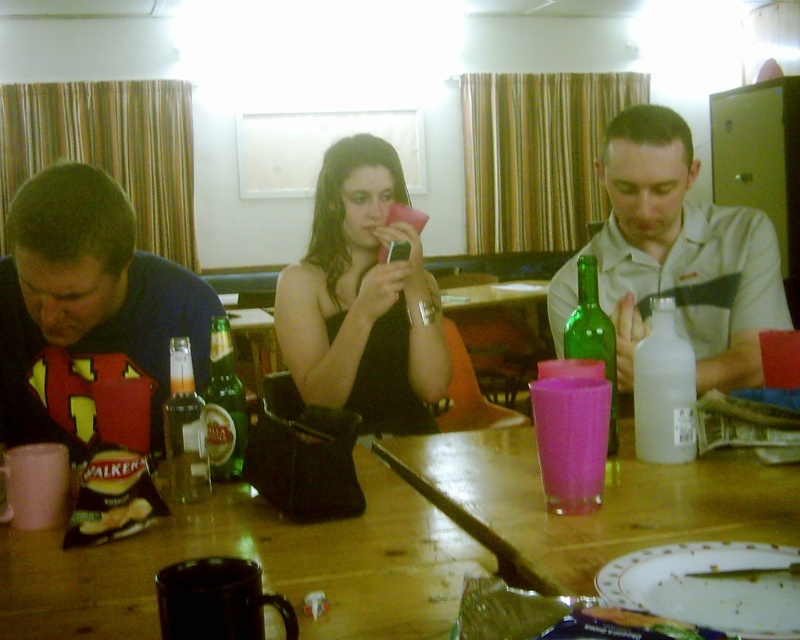
Question: Can you confirm if wooden table at center is positioned to the left of matte black shirt at left?

Choices:
 (A) no
 (B) yes

Answer: (A)

Question: Is green glass beer bottle at center wider than golden crispy chips at lower left?

Choices:
 (A) no
 (B) yes

Answer: (B)

Question: Which of these objects is positioned closest to the golden crispy chips at lower left?

Choices:
 (A) matte black shirt at left
 (B) green glass beer bottle at center
 (C) translucent glass bottle at center
 (D) white plastic bottle at right

Answer: (C)

Question: Which is farther from the white plastic bottle at right?

Choices:
 (A) pink plastic cup at center
 (B) matte black phone at center
 (C) green glass beer bottle at center
 (D) translucent glass bottle at center

Answer: (D)

Question: Among these points, which one is farthest from the camera?

Choices:
 (A) (556, 547)
 (B) (352, 157)

Answer: (B)

Question: Can you confirm if green glass bottle at center is wider than golden crispy chips at lower left?

Choices:
 (A) yes
 (B) no

Answer: (A)